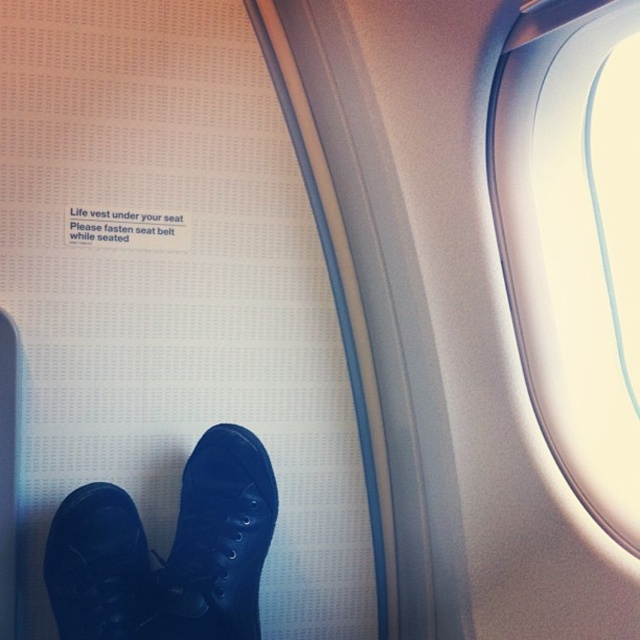
Question: Which point is farther to the camera?

Choices:
 (A) (515, 150)
 (B) (90, 604)
 (C) (202, 451)

Answer: (C)

Question: Among these points, which one is nearest to the camera?

Choices:
 (A) (500, 168)
 (B) (67, 515)

Answer: (A)

Question: Which point is closer to the camera?

Choices:
 (A) (589, 152)
 (B) (106, 493)
 (C) (188, 470)

Answer: (A)

Question: Is black canvas shoe at lower center positioned behind black leather shoe at lower left?

Choices:
 (A) yes
 (B) no

Answer: (A)

Question: Is transparent glass airplane window at upper right smaller than black canvas shoe at lower center?

Choices:
 (A) no
 (B) yes

Answer: (A)

Question: Does black canvas shoe at lower center have a smaller size compared to black leather shoe at lower left?

Choices:
 (A) no
 (B) yes

Answer: (A)